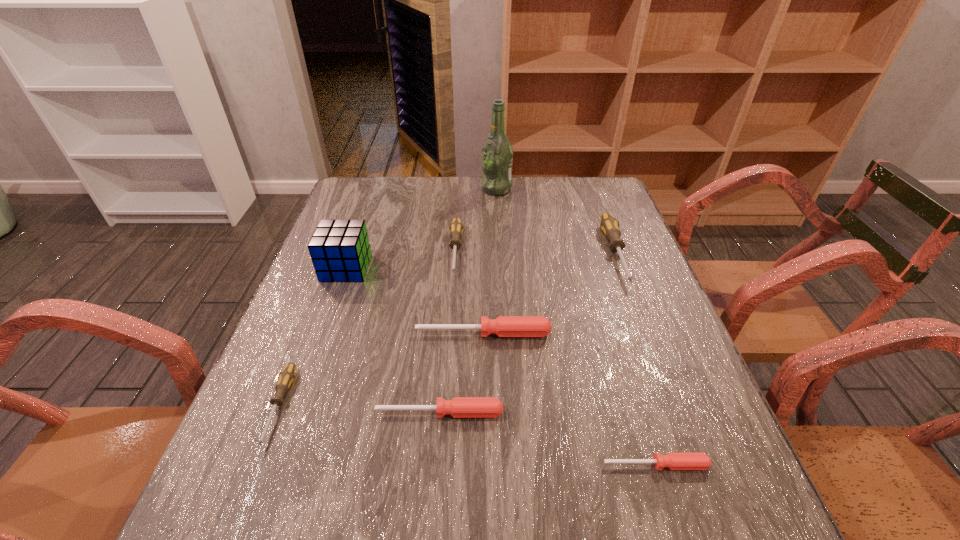
Identify the location of vacant area at the right edge of the desktop. (655, 376).

The image size is (960, 540). In the image, there is a desktop. Identify the location of vacant region at the far left corner. (397, 180).

Identify the location of free space at the far right corner. [607, 189].

Find the location of `free spot between the rightmost gray screwdriver and the beer bottle`. free spot between the rightmost gray screwdriver and the beer bottle is located at coordinates (556, 221).

Where is `vacant space that is in between the tallest object and the leftmost gray screwdriver`? This screenshot has width=960, height=540. vacant space that is in between the tallest object and the leftmost gray screwdriver is located at coordinates (388, 298).

Locate an element on the screen. This screenshot has height=540, width=960. free space between the second gray screwdriver from left to right and the sixth shortest object is located at coordinates (536, 252).

Where is `unoccupied area between the biggest red screwdriver and the second smallest red screwdriver`? The width and height of the screenshot is (960, 540). unoccupied area between the biggest red screwdriver and the second smallest red screwdriver is located at coordinates (462, 373).

What are the coordinates of `free space between the rightmost red screwdriver and the second gray screwdriver from left to right` in the screenshot? It's located at (556, 358).

Locate an element on the screen. The width and height of the screenshot is (960, 540). free space between the shortest screwdriver and the biggest red screwdriver is located at coordinates (569, 399).

This screenshot has height=540, width=960. Identify the location of unoccupied area between the beer bottle and the second tallest object. (421, 228).